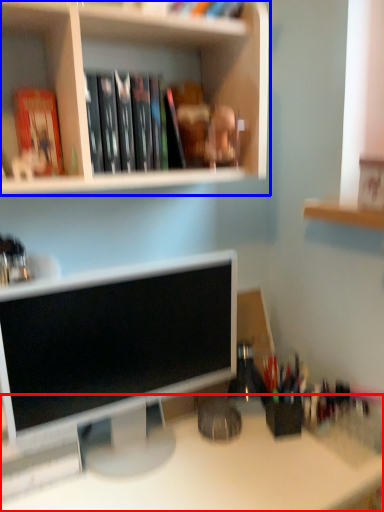
Question: Which object is closer to the camera taking this photo, desk (highlighted by a red box) or shelf (highlighted by a blue box)?

Choices:
 (A) desk
 (B) shelf

Answer: (A)